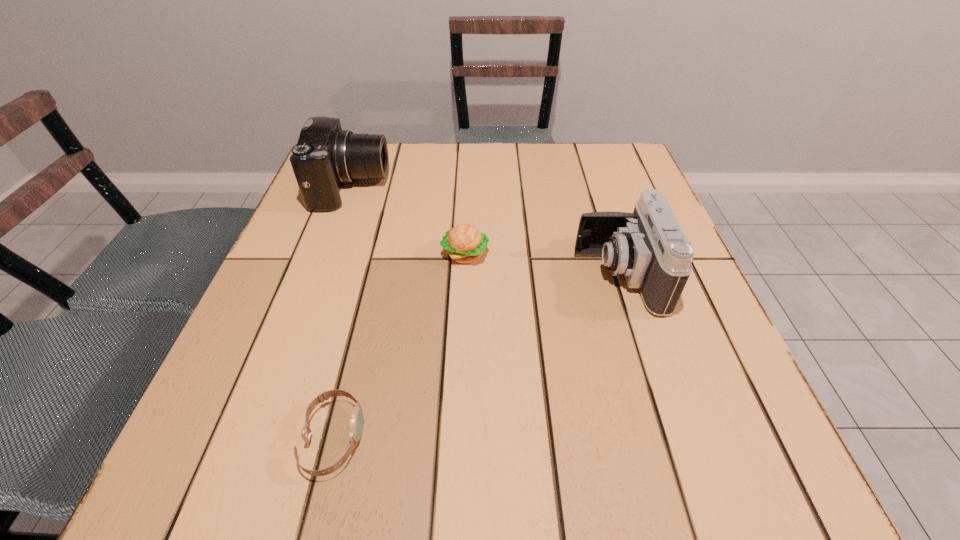
At what (x,y) coordinates should I click in order to perform the action: click on object that is positioned at the near left corner. Please return your answer as a coordinate pair (x, y). Looking at the image, I should click on (356, 418).

This screenshot has width=960, height=540. I want to click on vacant space at the far edge, so click(x=540, y=153).

What are the coordinates of `vacant region at the near edge of the desktop` in the screenshot? It's located at (612, 500).

In the image, there is a desktop. Where is `vacant space at the left edge`? The image size is (960, 540). vacant space at the left edge is located at coordinates (304, 259).

Find the location of a particular element. The width and height of the screenshot is (960, 540). vacant space at the right edge is located at coordinates (701, 334).

Find the location of a particular element. Image resolution: width=960 pixels, height=540 pixels. vacant space at the far right corner of the desktop is located at coordinates (586, 156).

In the image, there is a desktop. At what (x,y) coordinates should I click in order to perform the action: click on free space at the near right corner. Please return your answer as a coordinate pair (x, y). Image resolution: width=960 pixels, height=540 pixels. Looking at the image, I should click on (664, 453).

Where is `empty location between the nearest object and the rightmost object`? The image size is (960, 540). empty location between the nearest object and the rightmost object is located at coordinates (476, 357).

This screenshot has height=540, width=960. I want to click on vacant point located between the farther camera and the right camera, so click(x=485, y=232).

The height and width of the screenshot is (540, 960). Find the location of `empty location between the farthest object and the rightmost object`. empty location between the farthest object and the rightmost object is located at coordinates (485, 232).